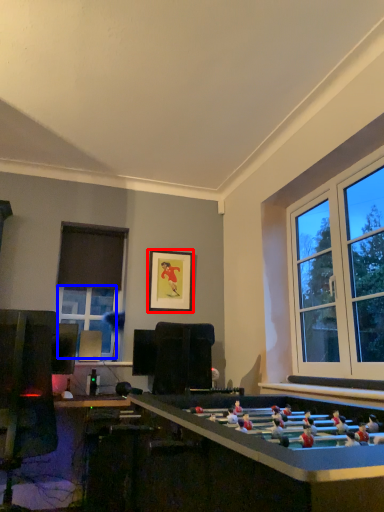
Question: Which object appears farthest to the camera in this image, picture frame (highlighted by a red box) or window (highlighted by a blue box)?

Choices:
 (A) picture frame
 (B) window

Answer: (A)